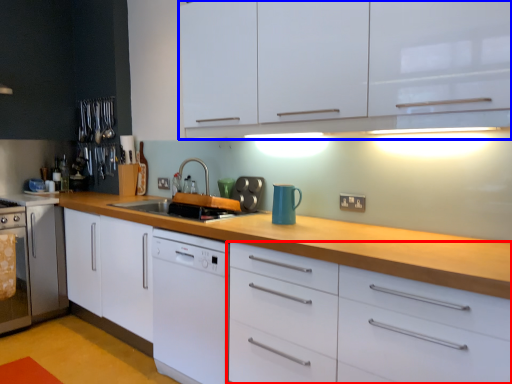
Question: Which point is further to the camera, drawer (highlighted by a red box) or cabinetry (highlighted by a blue box)?

Choices:
 (A) drawer
 (B) cabinetry

Answer: (B)